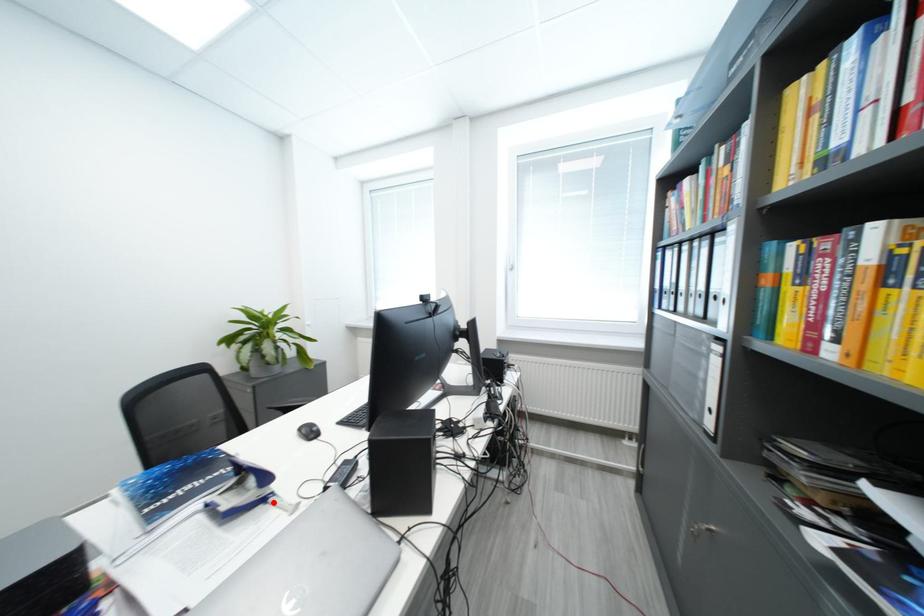
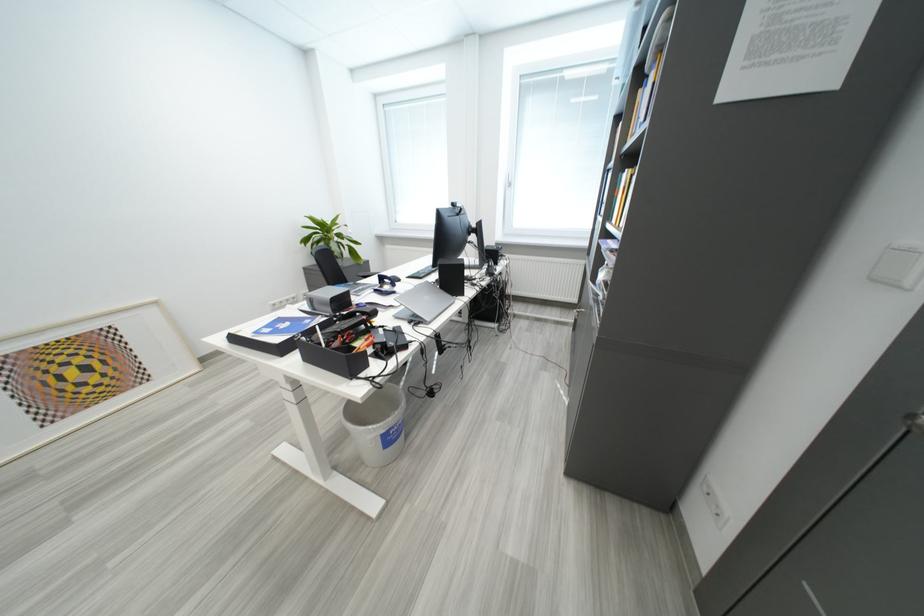
Where in the second image is the point corresponding to the highlighted location from the first image?

(403, 294)